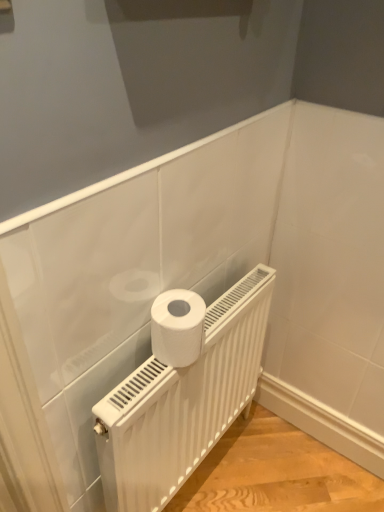
Find the location of `vacant area on top of white matte radiator at center (from a real-world perspective)`. vacant area on top of white matte radiator at center (from a real-world perspective) is located at coordinates (167, 357).